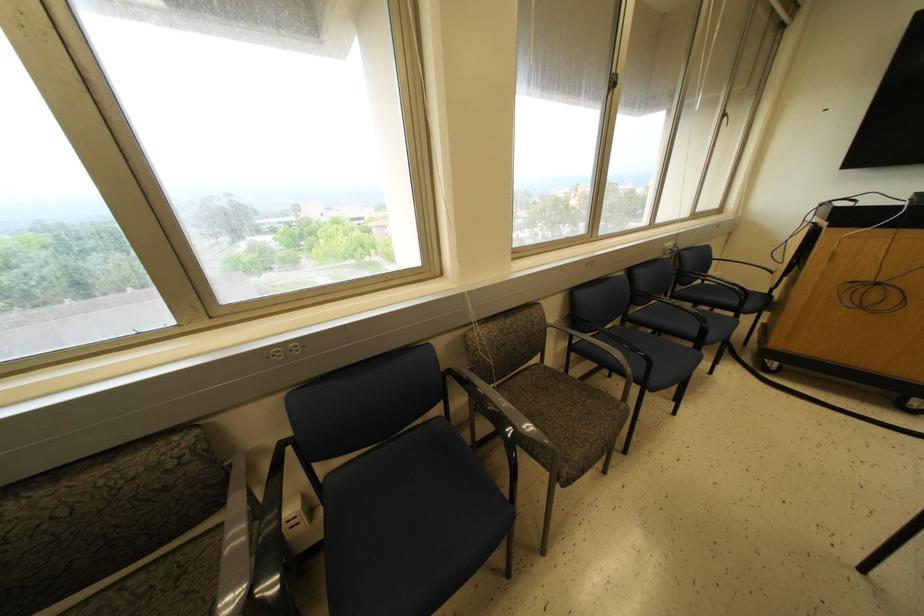
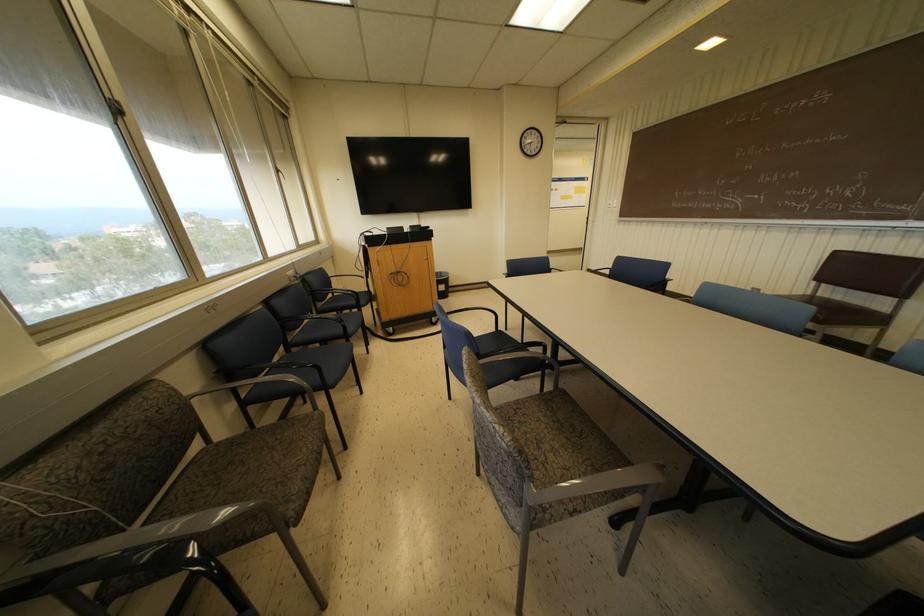
In the second image, find the point that corresponds to point 544,367 in the first image.

(217, 444)